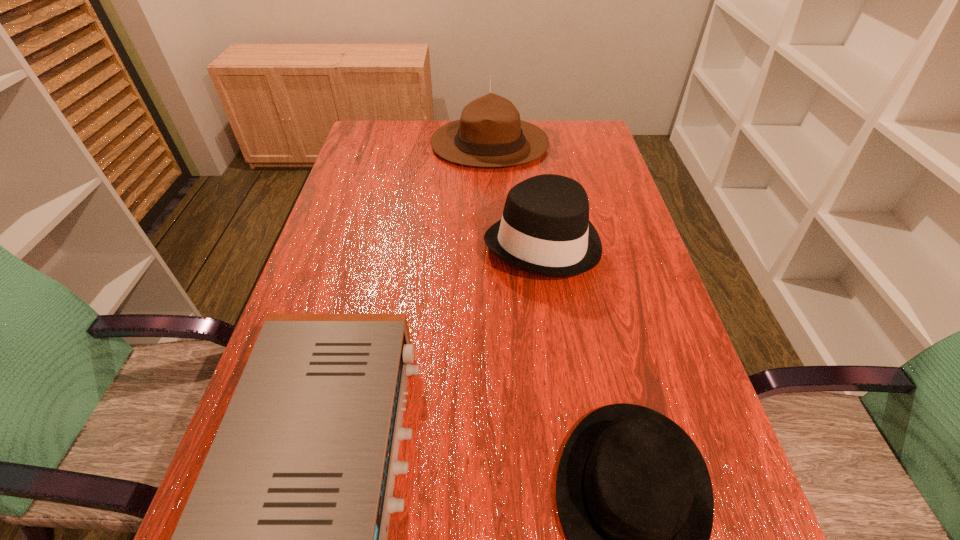
This screenshot has width=960, height=540. I want to click on free region at the far left corner, so click(407, 124).

Locate an element on the screen. This screenshot has height=540, width=960. vacant space at the far right corner of the desktop is located at coordinates (564, 131).

This screenshot has height=540, width=960. What are the coordinates of `the closest object to the third tallest object` in the screenshot? It's located at click(x=545, y=230).

Locate an element on the screen. object identified as the second closest to the second shortest object is located at coordinates (634, 496).

Identify which fedora is the second closest to the second shortest object. Please provide its 2D coordinates. Your answer should be formatted as a tuple, i.e. [(x, y)], where the tuple contains the x and y coordinates of a point satisfying the conditions above.

[(634, 496)]

Locate which fedora ranks in proximity to the second farthest object. Please provide its 2D coordinates. Your answer should be formatted as a tuple, i.e. [(x, y)], where the tuple contains the x and y coordinates of a point satisfying the conditions above.

[(489, 133)]

Find the location of a particular element. vacant space that satisfies the following two spatial constraints: 1. on the feather side of the second farthest fedora; 2. on the right side of the farthest object is located at coordinates (492, 242).

I want to click on vacant space that satisfies the following two spatial constraints: 1. on the back side of the second farthest object; 2. on the feather side of the farthest object, so click(x=528, y=144).